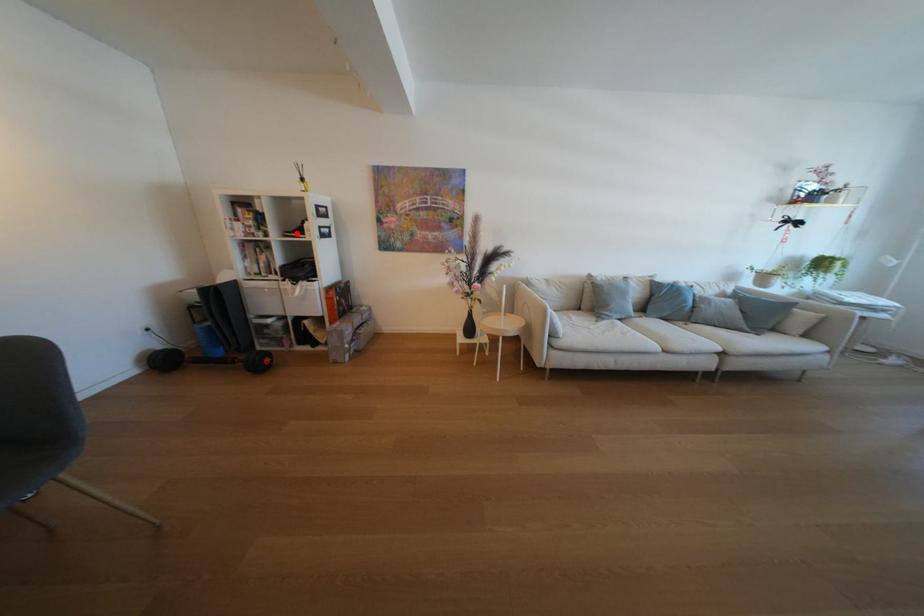
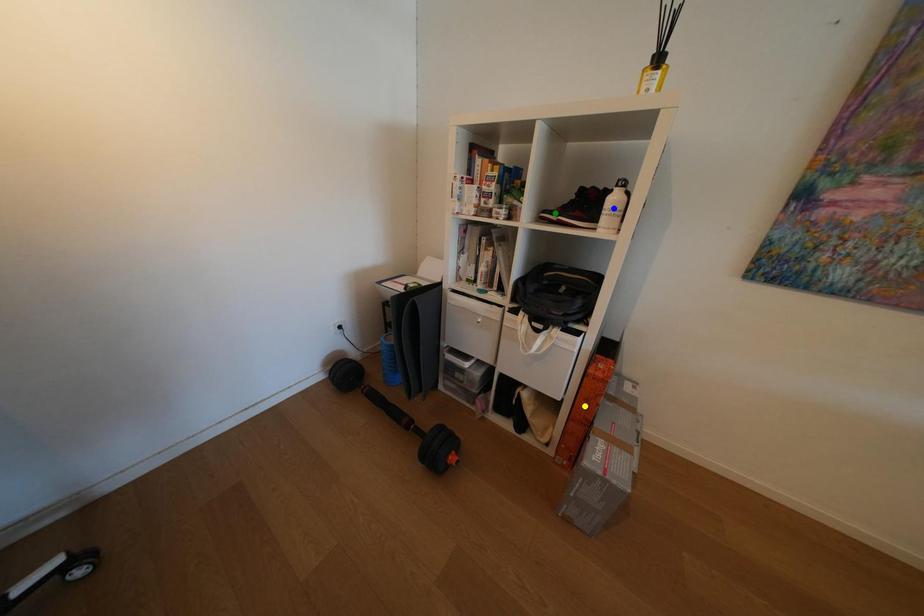
Question: I am providing you with two images of the same scene from different viewpoints. A red point is marked on the first image. You are given multiple points on the second image. Which point in image 2 represents the same 3d spot as the red point in image 1?

Choices:
 (A) yellow point
 (B) green point
 (C) blue point

Answer: (B)